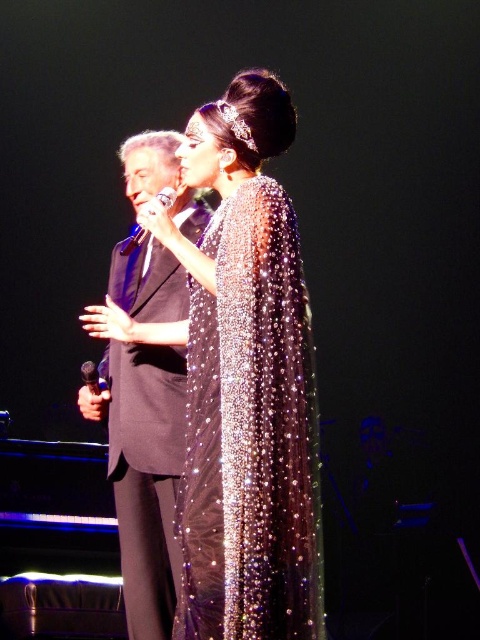
You are a stagehand who needs to adjust the lighting for the performers. The black satin suit at center and the metallic silver microphone at upper center are both in your line of sight. Which object is positioned higher relative to the other?

The metallic silver microphone at upper center is positioned higher than the black satin suit at center.

You are a stagehand who needs to position a spotlight exactly halfway between the two points on stage. The coordinates of the points are point [252,525] and point [91,385]. What are the coordinates of the midpoint?

The midpoint between point [252,525] and point [91,385] is calculated by averaging the x and y coordinates. The midpoint coordinates are 0.712, 0.358.

You are a photographer at the back of the venue and want to capture a clear photo of both the sparkly sequined dress at center and the black satin suit at center. Which one is closer to you?

The sparkly sequined dress at center is in front of the black satin suit at center, so the sparkly sequined dress at center is closer to you.